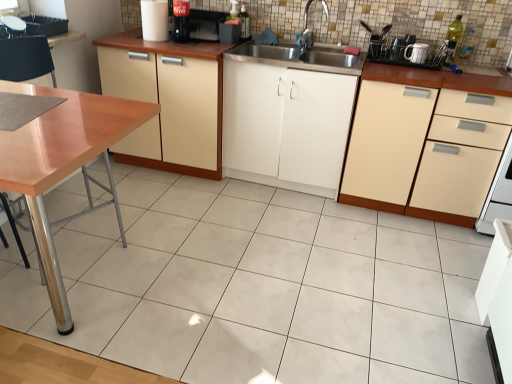
Where is `vacant area on the back side of wooden table at left`? The image size is (512, 384). vacant area on the back side of wooden table at left is located at coordinates (169, 213).